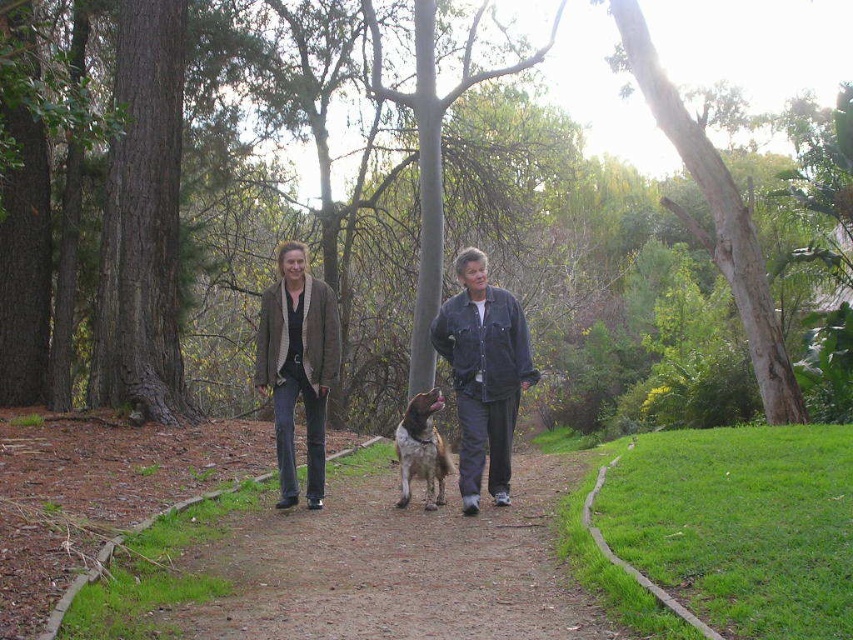
Is point (265, 321) more distant than point (503, 433)?

That is True.

Does brown leather jacket at center lie in front of denim jacket at center?

No.

Between point (316, 358) and point (494, 433), which one is positioned behind?

Positioned behind is point (316, 358).

This screenshot has width=853, height=640. Find the location of `brown leather jacket at center`. brown leather jacket at center is located at coordinates (299, 365).

Consider the image. Can you confirm if denim jacket at center is smaller than brown suede jacket at center?

No.

Is denim jacket at center bigger than brown suede jacket at center?

Correct, denim jacket at center is larger in size than brown suede jacket at center.

Which is in front, point (488, 352) or point (334, 300)?

Positioned in front is point (488, 352).

The height and width of the screenshot is (640, 853). Identify the location of denim jacket at center. (483, 374).

Find the location of a particular element. The width and height of the screenshot is (853, 640). brown leather jacket at center is located at coordinates (299, 365).

Between brown leather jacket at center and brown suede jacket at center, which one is positioned higher?

Positioned higher is brown leather jacket at center.

You are a GUI agent. You are given a task and a screenshot of the screen. Output one action in this format:
    pyautogui.click(x=<x>, y=<y>)
    Task: Click on the brown leather jacket at center
    This screenshot has height=640, width=853.
    Given the screenshot: What is the action you would take?
    click(299, 365)

The image size is (853, 640). I want to click on brown leather jacket at center, so click(299, 365).